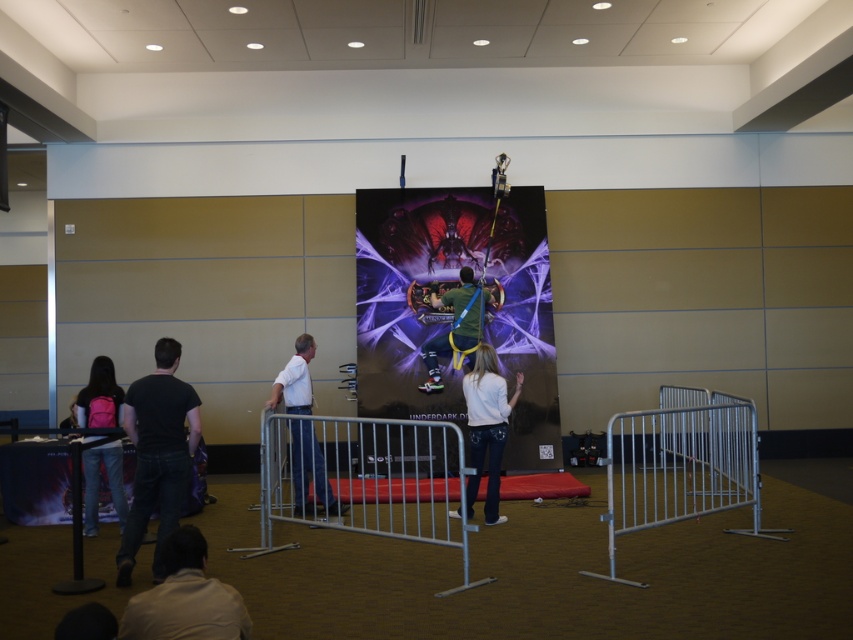
Question: Which object is the closest to the black cotton shirt at lower left?

Choices:
 (A) silver metallic rail at center
 (B) green fabric shirt at center
 (C) white denim jeans at center
 (D) silver metallic barrier at lower right

Answer: (A)

Question: Which point is closer to the camera taking this photo?

Choices:
 (A) (366, 499)
 (B) (151, 628)

Answer: (B)

Question: Can you confirm if silver metallic barrier at lower right is positioned below white matte shirt at center?

Choices:
 (A) no
 (B) yes

Answer: (B)

Question: Which is farther from the white shirt at lower left?

Choices:
 (A) black cotton shirt at lower left
 (B) pink fabric backpack at lower left
 (C) silver metallic rail at center

Answer: (C)

Question: Is white denim jeans at center wider than green fabric shirt at center?

Choices:
 (A) no
 (B) yes

Answer: (B)

Question: Is black cotton shirt at lower left to the right of green fabric shirt at center from the viewer's perspective?

Choices:
 (A) no
 (B) yes

Answer: (A)